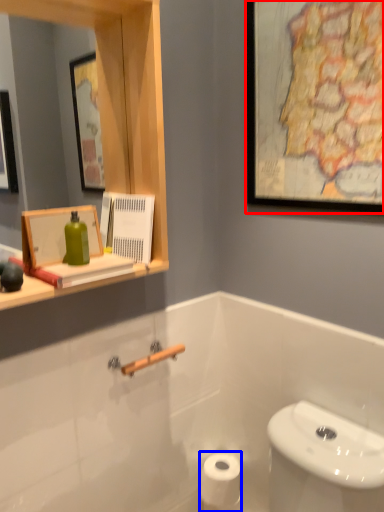
Question: Which of the following is the closest to the observer, picture frame (highlighted by a red box) or toilet paper (highlighted by a blue box)?

Choices:
 (A) picture frame
 (B) toilet paper

Answer: (A)